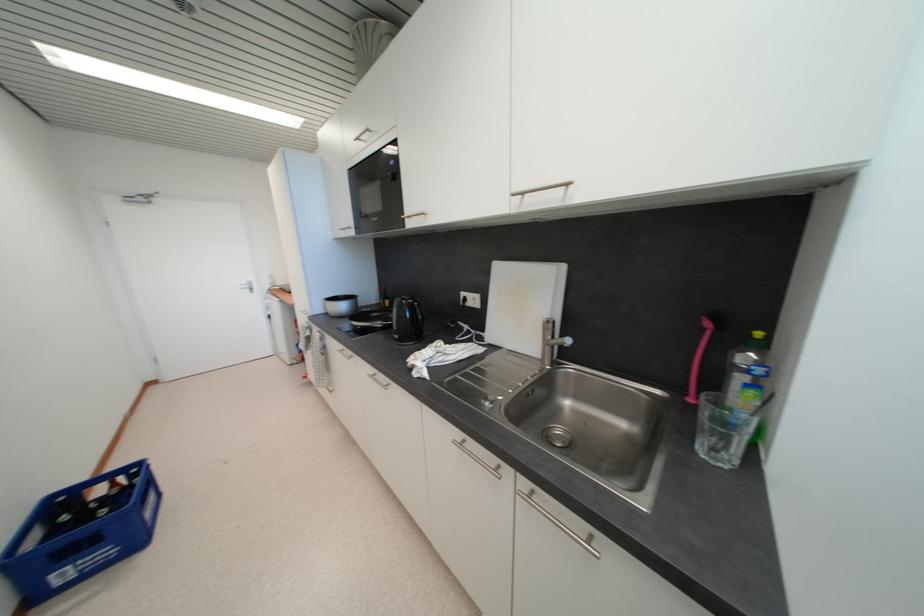
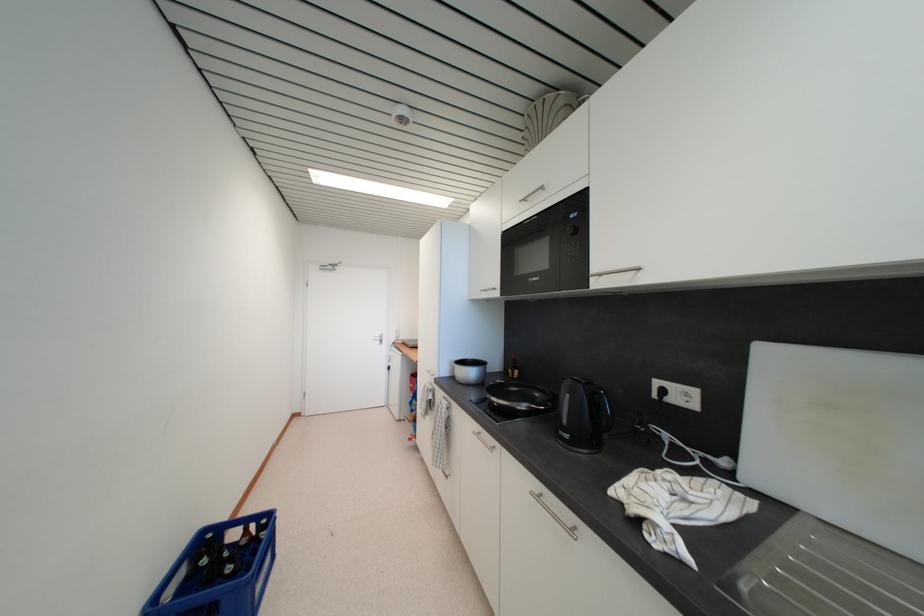
Question: Based on the continuous images, in which direction is the camera rotating? Reply with the corresponding letter.

Choices:
 (A) Left
 (B) Right
 (C) Up
 (D) Down

Answer: (A)